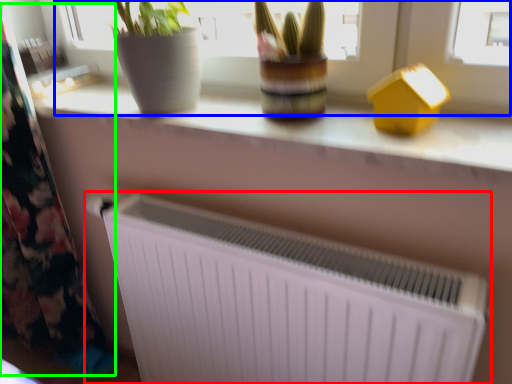
Question: Based on their relative distances, which object is nearer to radiator (highlighted by a red box)? Choose from bay window (highlighted by a blue box) and curtain (highlighted by a green box).

Choices:
 (A) bay window
 (B) curtain

Answer: (A)